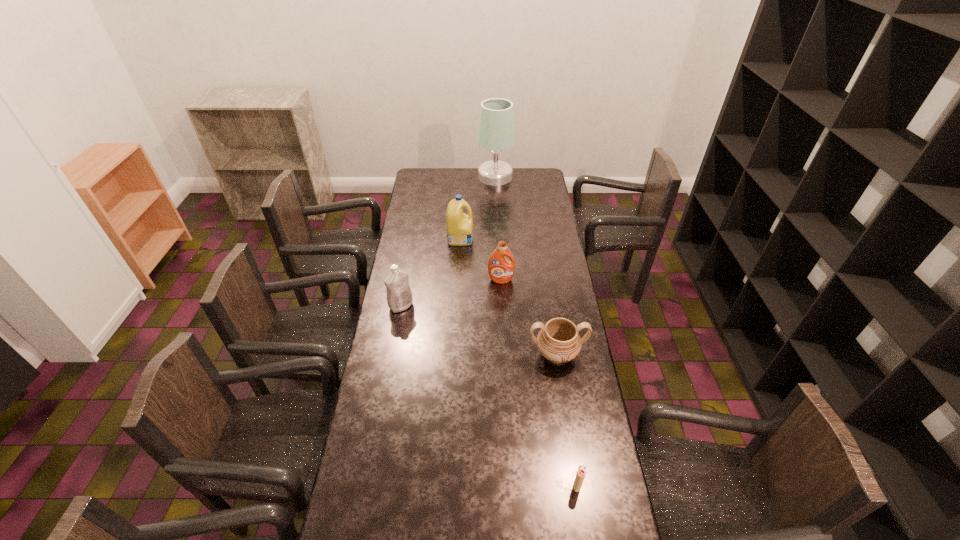
At what (x,y) coordinates should I click in order to perform the action: click on empty space that is in between the fourth nearest object and the farthest detergent. Please return your answer as a coordinate pair (x, y). This screenshot has width=960, height=540. Looking at the image, I should click on (481, 259).

Locate an element on the screen. unoccupied area between the farthest object and the second detergent from right to left is located at coordinates (478, 207).

Locate an element on the screen. The height and width of the screenshot is (540, 960). vacant area that lies between the urn and the third farthest object is located at coordinates (529, 318).

The width and height of the screenshot is (960, 540). Find the location of `free space between the lampshade and the fifth tallest object`. free space between the lampshade and the fifth tallest object is located at coordinates (526, 266).

Find the location of a particular element. Image resolution: width=960 pixels, height=540 pixels. blank region between the shortest object and the farthest object is located at coordinates (536, 331).

The width and height of the screenshot is (960, 540). I want to click on free spot between the second farthest detergent and the nearest object, so click(x=540, y=383).

You are a GUI agent. You are given a task and a screenshot of the screen. Output one action in this format:
    pyautogui.click(x=<x>, y=<y>)
    Task: Click on the fifth closest object relative to the second detergent from left to right
    
    Given the screenshot: What is the action you would take?
    pyautogui.click(x=581, y=472)

Locate which object is the fourth closest to the farthest object. Please provide its 2D coordinates. Your answer should be formatted as a tuple, i.e. [(x, y)], where the tuple contains the x and y coordinates of a point satisfying the conditions above.

[(558, 341)]

You are a GUI agent. You are given a task and a screenshot of the screen. Output one action in this format:
    pyautogui.click(x=<x>, y=<y>)
    Task: Click on the detergent that is the closest to the second detergent from left to right
    This screenshot has width=960, height=540.
    Given the screenshot: What is the action you would take?
    pos(501,270)

This screenshot has width=960, height=540. What are the coordinates of `detergent identified as the third closest to the lampshade` in the screenshot? It's located at (399, 295).